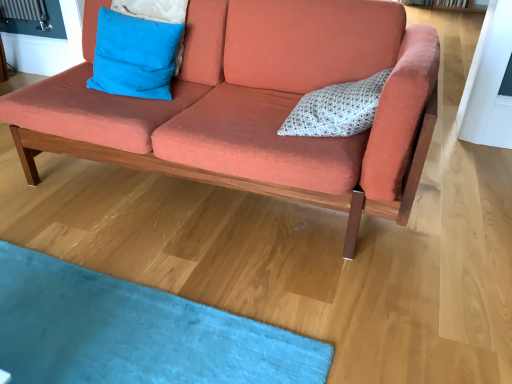
Question: Is coral fabric couch at center shorter than blue suede pillow at upper left, which ranks as the second pillow in right-to-left order?

Choices:
 (A) no
 (B) yes

Answer: (A)

Question: From the image's perspective, is coral fabric couch at center located above blue suede pillow at upper left, which ranks as the second pillow in right-to-left order?

Choices:
 (A) no
 (B) yes

Answer: (A)

Question: Does coral fabric couch at center have a greater width compared to blue suede pillow at upper left, the 1th pillow from the left?

Choices:
 (A) yes
 (B) no

Answer: (A)

Question: Does coral fabric couch at center come in front of blue suede pillow at upper left, the 1th pillow from the left?

Choices:
 (A) yes
 (B) no

Answer: (A)

Question: Can you confirm if coral fabric couch at center is taller than blue suede pillow at upper left, the 1th pillow from the left?

Choices:
 (A) no
 (B) yes

Answer: (B)

Question: Considering the positions of blue suede pillow at upper left, the 1th pillow from the left, and coral fabric couch at center in the image, is blue suede pillow at upper left, the 1th pillow from the left, bigger or smaller than coral fabric couch at center?

Choices:
 (A) big
 (B) small

Answer: (B)

Question: Is blue suede pillow at upper left, the 1th pillow from the left, taller or shorter than coral fabric couch at center?

Choices:
 (A) short
 (B) tall

Answer: (A)

Question: From the image's perspective, is blue suede pillow at upper left, the 1th pillow from the left, positioned above or below coral fabric couch at center?

Choices:
 (A) below
 (B) above

Answer: (B)

Question: Based on their positions, is blue suede pillow at upper left, the 1th pillow from the left, located to the left or right of coral fabric couch at center?

Choices:
 (A) left
 (B) right

Answer: (A)

Question: In the image, is coral fabric couch at center positioned in front of or behind blue suede pillow at upper left, which ranks as the second pillow in right-to-left order?

Choices:
 (A) front
 (B) behind

Answer: (A)

Question: In terms of height, does coral fabric couch at center look taller or shorter compared to blue suede pillow at upper left, which ranks as the second pillow in right-to-left order?

Choices:
 (A) tall
 (B) short

Answer: (A)

Question: Is point (273, 82) closer or farther from the camera than point (134, 82)?

Choices:
 (A) closer
 (B) farther

Answer: (B)

Question: Looking at the image, does coral fabric couch at center seem bigger or smaller compared to blue suede pillow at upper left, which ranks as the second pillow in right-to-left order?

Choices:
 (A) big
 (B) small

Answer: (A)

Question: Is white dotted fabric pillow at center, which ranks as the 1th pillow in right-to-left order, wider or thinner than blue suede pillow at upper left, the 1th pillow from the left?

Choices:
 (A) wide
 (B) thin

Answer: (A)

Question: In terms of height, does white dotted fabric pillow at center, acting as the 2th pillow starting from the left, look taller or shorter compared to blue suede pillow at upper left, which ranks as the second pillow in right-to-left order?

Choices:
 (A) short
 (B) tall

Answer: (A)